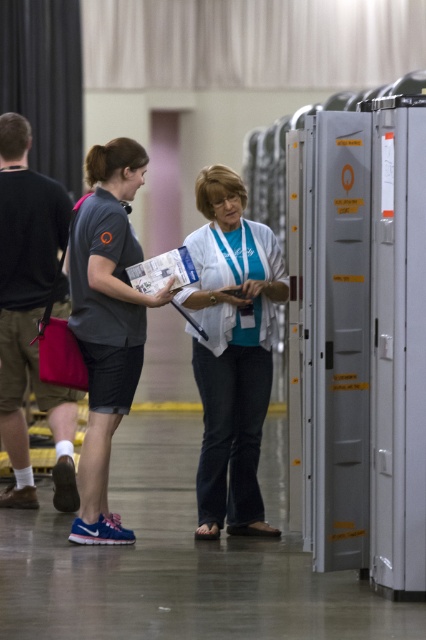
Question: Is white matte shirt at center below dark brown leather shoes at left?

Choices:
 (A) yes
 (B) no

Answer: (A)

Question: Which object appears farthest from the camera in this image?

Choices:
 (A) matte gray shirt at center
 (B) white matte shirt at center

Answer: (B)

Question: Which point is closer to the camera taking this photo?

Choices:
 (A) (17, 189)
 (B) (114, 401)
 (C) (227, 420)

Answer: (B)

Question: From the image, what is the correct spatial relationship of white matte shirt at center in relation to matte gray shirt at center?

Choices:
 (A) right
 (B) left

Answer: (A)

Question: Does white matte shirt at center have a larger size compared to matte gray shirt at center?

Choices:
 (A) yes
 (B) no

Answer: (A)

Question: Based on their relative distances, which object is nearer to the dark brown leather shoes at left?

Choices:
 (A) white matte shirt at center
 (B) matte gray shirt at center

Answer: (B)